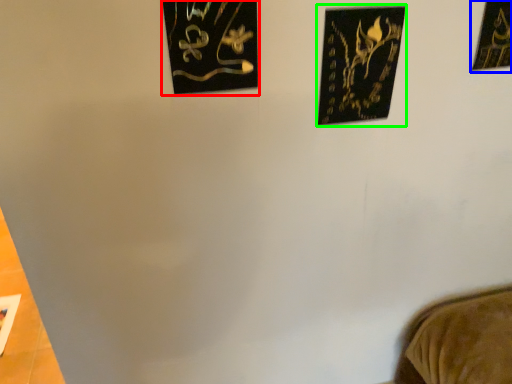
Question: Based on their relative distances, which object is nearer to picture frame (highlighted by a red box)? Choose from picture frame (highlighted by a blue box) and picture frame (highlighted by a green box).

Choices:
 (A) picture frame
 (B) picture frame

Answer: (B)